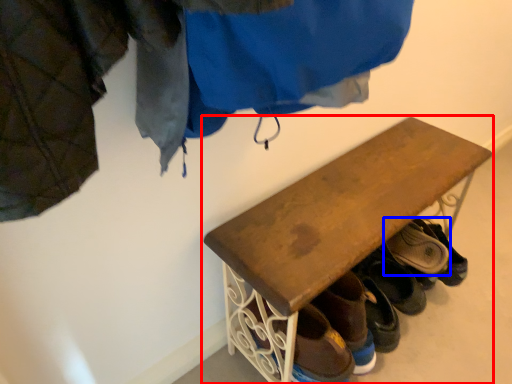
Question: Which object appears closest to the camera in this image, furniture (highlighted by a red box) or footwear (highlighted by a blue box)?

Choices:
 (A) furniture
 (B) footwear

Answer: (A)